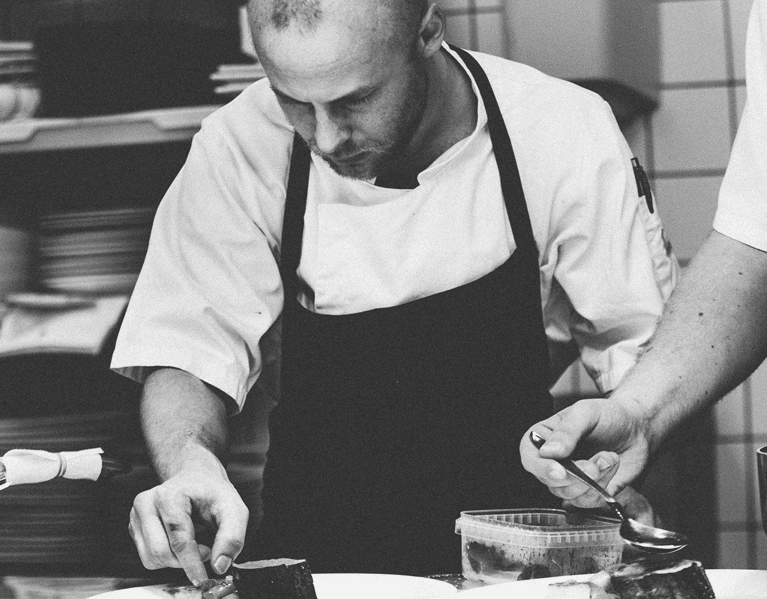
Where is `tile wall`? The width and height of the screenshot is (767, 599). tile wall is located at coordinates (594, 27).